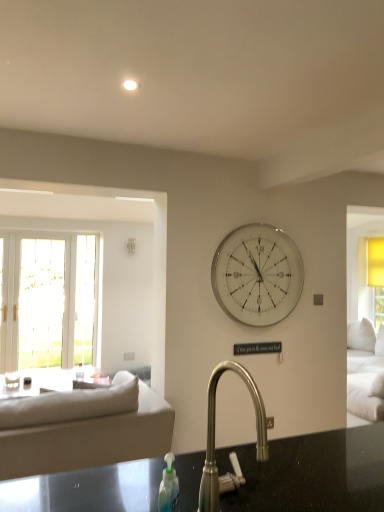
Question: Does point (84, 401) appear closer or farther from the camera than point (264, 297)?

Choices:
 (A) closer
 (B) farther

Answer: (A)

Question: From a real-world perspective, is beige fabric couch at left above or below white glass wall clock at center?

Choices:
 (A) below
 (B) above

Answer: (A)

Question: Which object is positioned farthest from the satin nickel faucet at center?

Choices:
 (A) white glass wall clock at center
 (B) beige fabric couch at left

Answer: (A)

Question: Estimate the real-world distances between objects in this image. Which object is farther from the white glass wall clock at center?

Choices:
 (A) satin nickel faucet at center
 (B) beige fabric couch at left

Answer: (A)